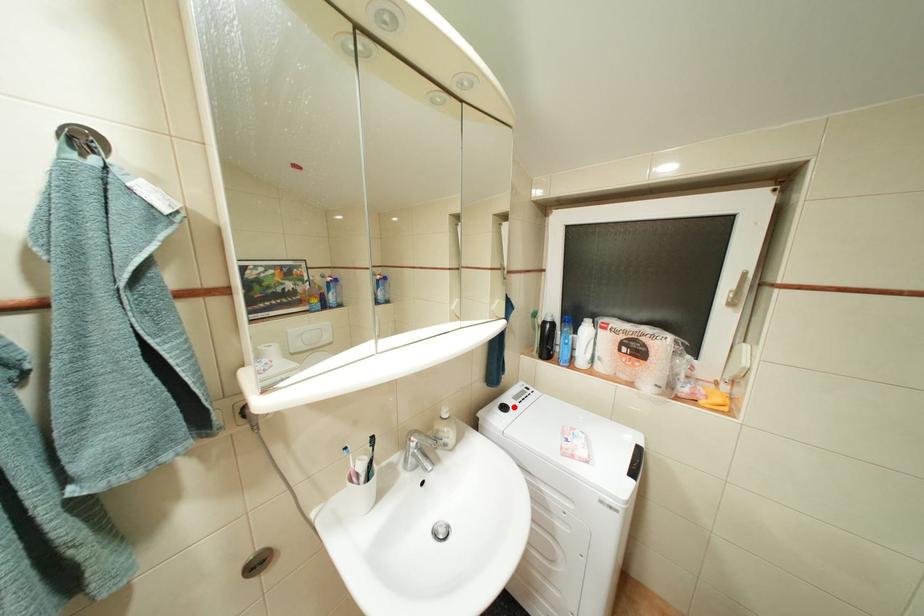
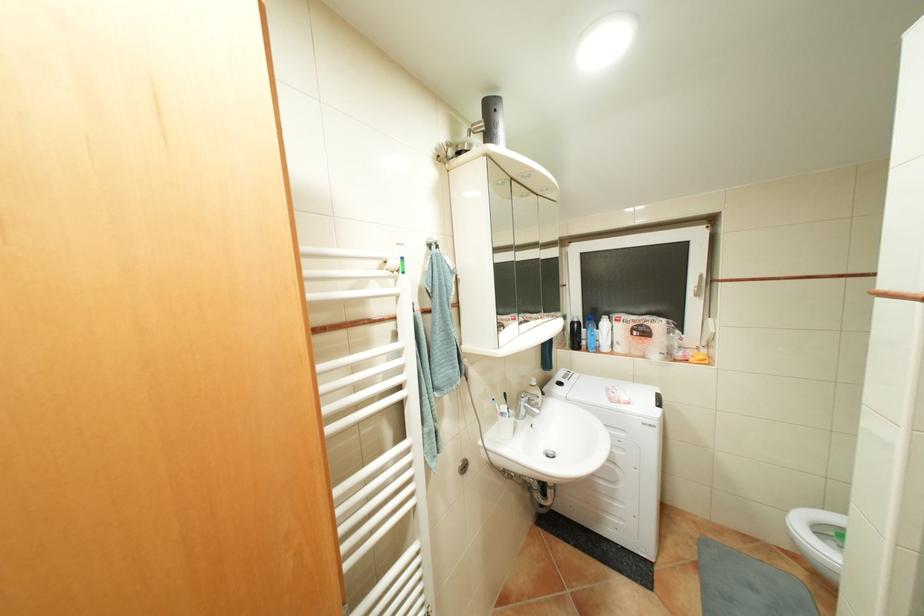
Where in the second image is the point corresponding to the highlighted location from the first image?

(569, 383)